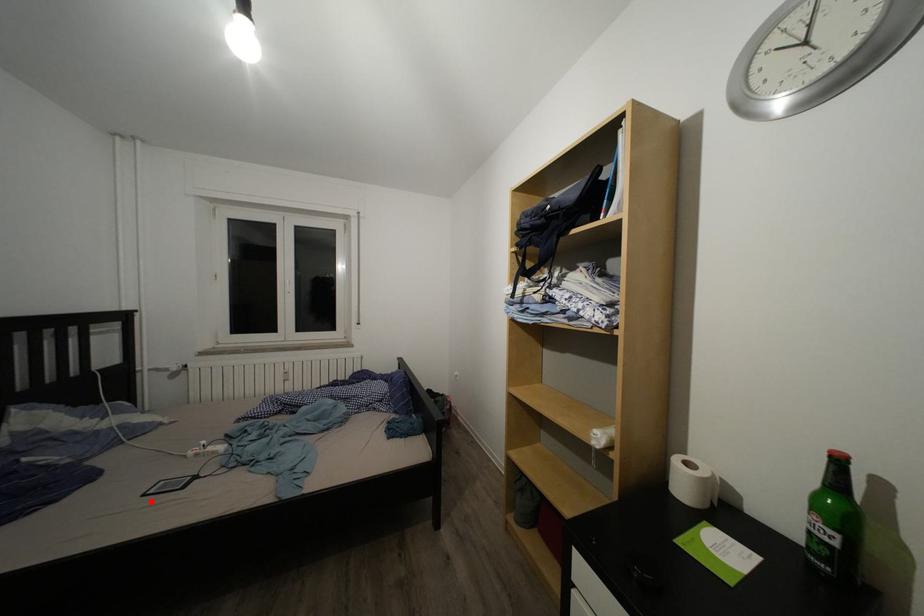
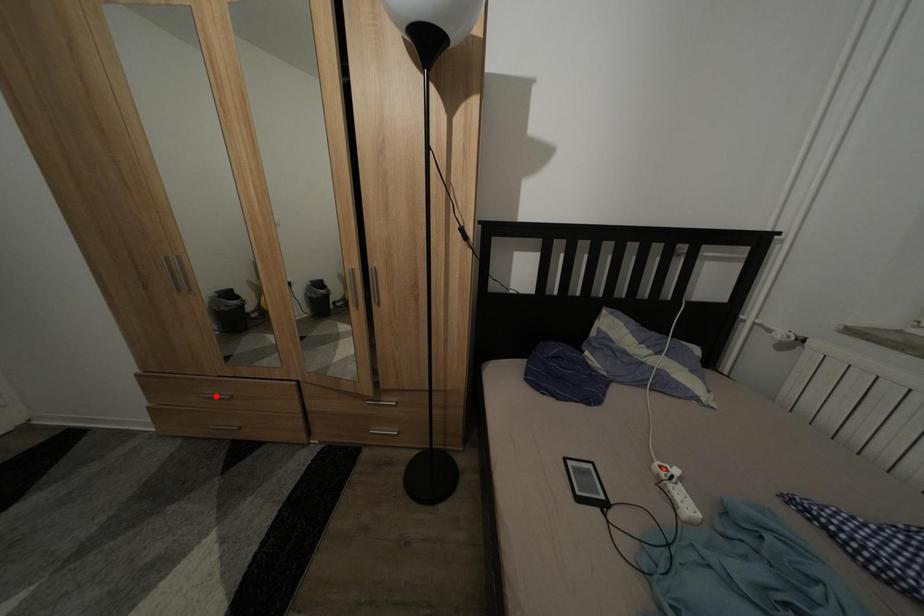
I am providing you with two images of the same scene from different viewpoints. A red point is marked on the first image and another point is marked on the second image. Do the highlighted points in image1 and image2 indicate the same real-world spot?

No